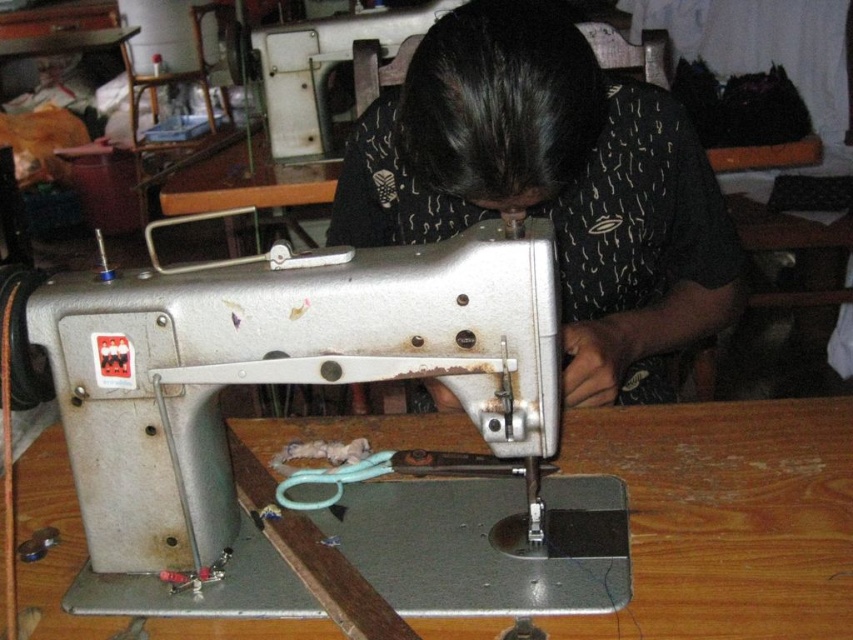
Measure the distance from black printed shirt at upper center to wooden table at center.

11.04 inches

Can you confirm if black printed shirt at upper center is positioned below wooden table at center?

No, black printed shirt at upper center is not below wooden table at center.

Who is more forward, (386, 209) or (552, 618)?

Point (552, 618) is more forward.

In order to click on black printed shirt at upper center in this screenshot , I will do 552,186.

Consider the image. Is silver metallic sewing machine at center taller than black printed shirt at upper center?

No, silver metallic sewing machine at center is not taller than black printed shirt at upper center.

Does silver metallic sewing machine at center come in front of black printed shirt at upper center?

That is True.

Between point (477, 333) and point (737, 264), which one is positioned in front?

Point (477, 333) is in front.

Identify the location of silver metallic sewing machine at center. (320, 385).

Can you confirm if silver metallic sewing machine at center is positioned to the right of wooden table at center?

Correct, you'll find silver metallic sewing machine at center to the right of wooden table at center.

Where is `silver metallic sewing machine at center`? silver metallic sewing machine at center is located at coordinates (320, 385).